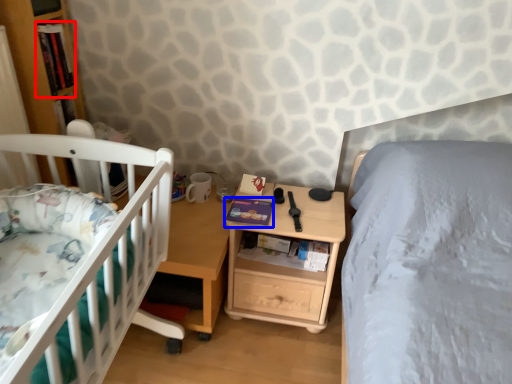
Question: Which object appears closest to the camera in this image, book (highlighted by a red box) or book (highlighted by a blue box)?

Choices:
 (A) book
 (B) book

Answer: (A)